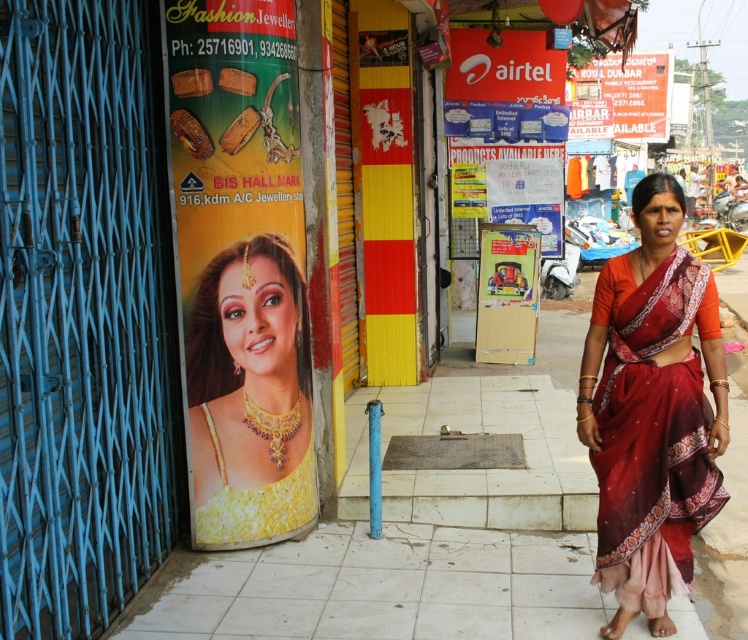
Question: Does yellow fabric poster at left appear on the left side of yellow satin dress at center?

Choices:
 (A) yes
 (B) no

Answer: (A)

Question: Considering the relative positions of yellow fabric poster at left and silky red sari at right in the image provided, where is yellow fabric poster at left located with respect to silky red sari at right?

Choices:
 (A) right
 (B) left

Answer: (B)

Question: Which object appears farthest from the camera in this image?

Choices:
 (A) yellow fabric poster at left
 (B) silky red sari at right
 (C) yellow fabric at center

Answer: (C)

Question: Which point appears closest to the camera in this image?

Choices:
 (A) (601, 576)
 (B) (211, 300)
 (C) (196, 528)

Answer: (A)

Question: Considering the real-world distances, which object is farthest from the yellow fabric poster at left?

Choices:
 (A) yellow satin dress at center
 (B) yellow fabric at center
 (C) silky red sari at right

Answer: (C)

Question: Can you confirm if silky red sari at right is thinner than yellow fabric at center?

Choices:
 (A) no
 (B) yes

Answer: (A)